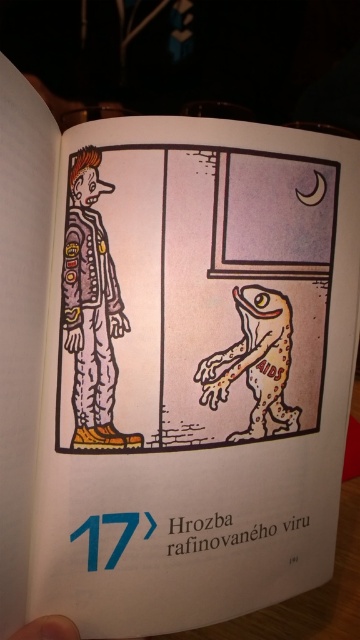
Based on the scene described, where is the matte purple jumpsuit at center located in the coordinate system of the image?

The matte purple jumpsuit at center is located at the coordinate point of [92,308] in the image.

You are an art student analyzing the comic page. You notice two central elements on the page. One is the matte purple jumpsuit at center and the other is the brown textured lizard at center. According to the illustration, which object is visually layered on top of the other?

The matte purple jumpsuit at center is positioned over brown textured lizard at center, meaning it is layered on top in the illustration.